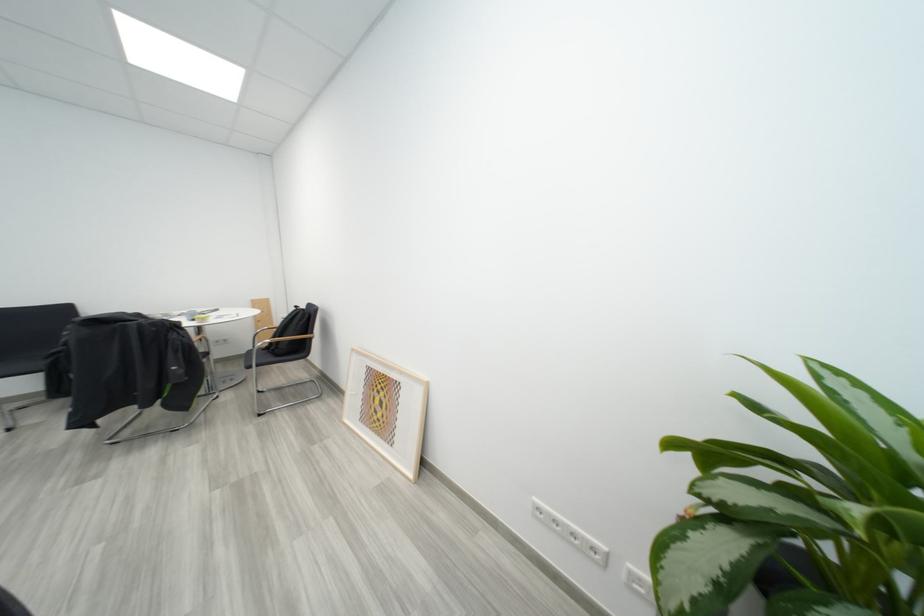
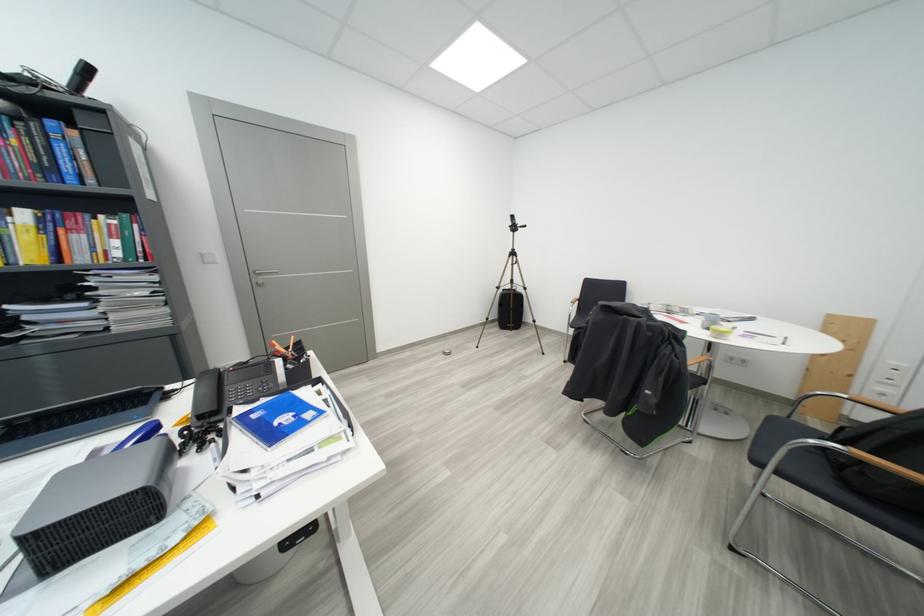
Find the pixel in the second image that matches (286,358) in the first image.

(856, 487)